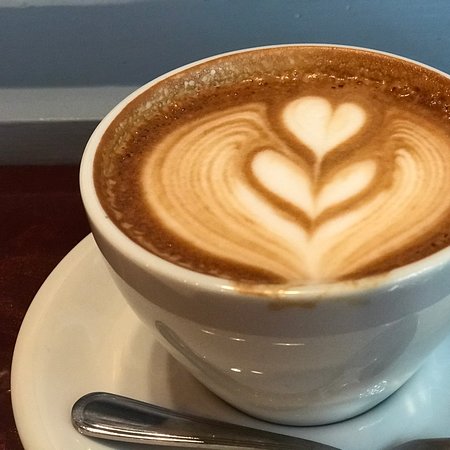
This screenshot has width=450, height=450. What are the coordinates of `cappuccino on rim of cup` in the screenshot? It's located at (278, 298), (355, 286).